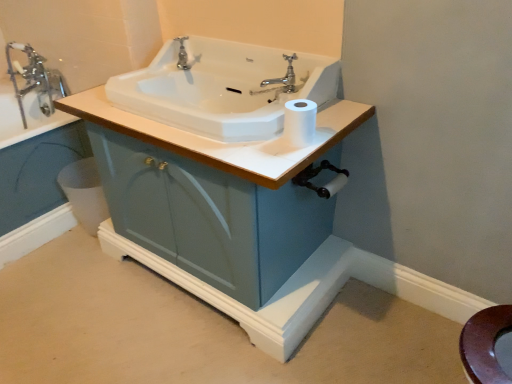
Question: Is polished chrome faucet at upper center, placed as the 1th tap when sorted from front to back, directly adjacent to chrome metallic faucet at upper left, marked as the 2th tap in a front-to-back arrangement?

Choices:
 (A) no
 (B) yes

Answer: (A)

Question: Is polished chrome faucet at upper center, acting as the first tap starting from the right, bigger than chrome metallic faucet at upper left, which is the first tap from back to front?

Choices:
 (A) no
 (B) yes

Answer: (A)

Question: From a real-world perspective, is polished chrome faucet at upper center, which is the 2th tap from back to front, below chrome metallic faucet at upper left, which is the first tap from back to front?

Choices:
 (A) yes
 (B) no

Answer: (B)

Question: Does polished chrome faucet at upper center, placed as the 1th tap when sorted from front to back, have a greater height compared to chrome metallic faucet at upper left, marked as the 2th tap in a front-to-back arrangement?

Choices:
 (A) no
 (B) yes

Answer: (A)

Question: Does polished chrome faucet at upper center, acting as the first tap starting from the right, come behind chrome metallic faucet at upper left, marked as the 2th tap in a front-to-back arrangement?

Choices:
 (A) yes
 (B) no

Answer: (B)

Question: From a real-world perspective, is polished chrome faucet at upper center, acting as the first tap starting from the right, above or below chrome metallic faucet at upper left, the 2th tap positioned from the right?

Choices:
 (A) above
 (B) below

Answer: (A)

Question: Looking at the image, does polished chrome faucet at upper center, placed as the 1th tap when sorted from front to back, seem bigger or smaller compared to chrome metallic faucet at upper left, which is the first tap from back to front?

Choices:
 (A) big
 (B) small

Answer: (B)

Question: Would you say polished chrome faucet at upper center, which ranks as the second tap in left-to-right order, is inside or outside chrome metallic faucet at upper left, which is the first tap from back to front?

Choices:
 (A) inside
 (B) outside

Answer: (B)

Question: Considering their positions, is polished chrome faucet at upper center, which ranks as the second tap in left-to-right order, located in front of or behind chrome metallic faucet at upper left, the 2th tap positioned from the right?

Choices:
 (A) front
 (B) behind

Answer: (A)

Question: Visually, is matte blue cabinet at center positioned to the left or to the right of chrome metallic faucet at upper left, marked as the 2th tap in a front-to-back arrangement?

Choices:
 (A) left
 (B) right

Answer: (B)

Question: Is matte blue cabinet at center taller or shorter than chrome metallic faucet at upper left, the 2th tap positioned from the right?

Choices:
 (A) tall
 (B) short

Answer: (A)

Question: Relative to chrome metallic faucet at upper left, the 2th tap positioned from the right, is matte blue cabinet at center in front or behind?

Choices:
 (A) behind
 (B) front

Answer: (B)

Question: Considering the positions of point (269, 322) and point (23, 122), is point (269, 322) closer or farther from the camera than point (23, 122)?

Choices:
 (A) farther
 (B) closer

Answer: (B)

Question: From the image's perspective, relative to chrome metallic faucet at upper left, which is the first tap from back to front, is white glossy bidet at lower left above or below?

Choices:
 (A) above
 (B) below

Answer: (B)

Question: In terms of height, does white glossy bidet at lower left look taller or shorter compared to chrome metallic faucet at upper left, the 1th tap viewed from the left?

Choices:
 (A) short
 (B) tall

Answer: (A)